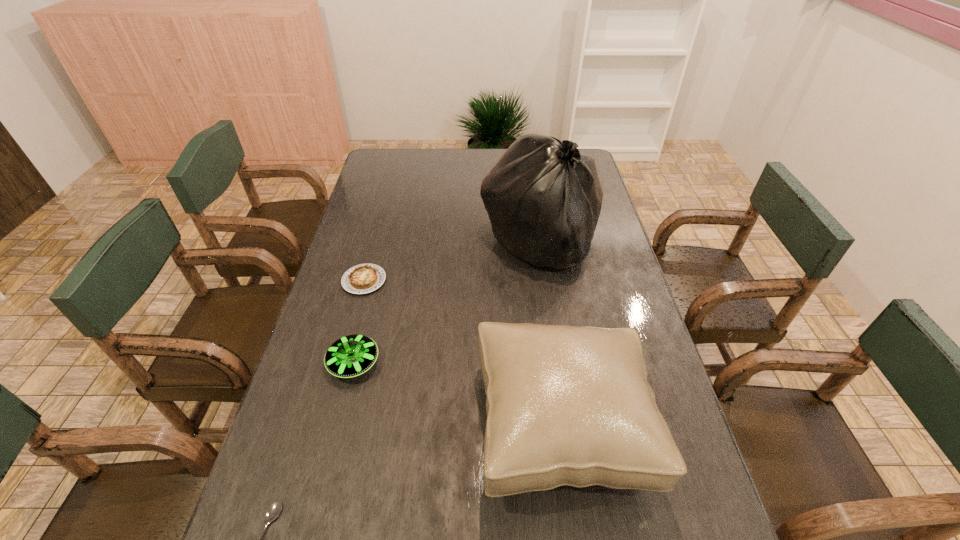
The image size is (960, 540). In order to click on object that can be found as the second closest to the quiche in this screenshot , I will do `click(543, 197)`.

Locate an element on the screen. The image size is (960, 540). object that ranks as the fourth closest to the cushion is located at coordinates (273, 510).

You are a GUI agent. You are given a task and a screenshot of the screen. Output one action in this format:
    pyautogui.click(x=<x>, y=<y>)
    Task: Click on the blank area in the image that satisfies the following two spatial constraints: 1. on the front side of the quiche; 2. on the left side of the cushion
    Image resolution: width=960 pixels, height=540 pixels.
    Given the screenshot: What is the action you would take?
    pyautogui.click(x=325, y=425)